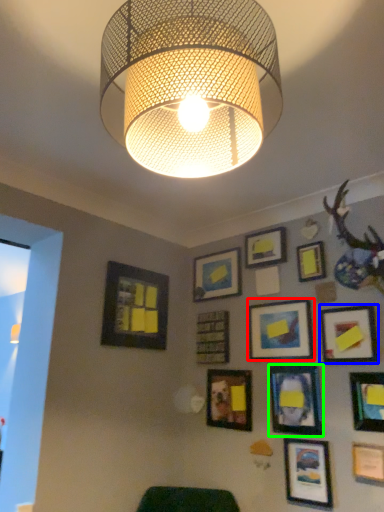
Question: Which is farther away from picture frame (highlighted by a red box)? picture frame (highlighted by a blue box) or picture frame (highlighted by a green box)?

Choices:
 (A) picture frame
 (B) picture frame

Answer: (A)